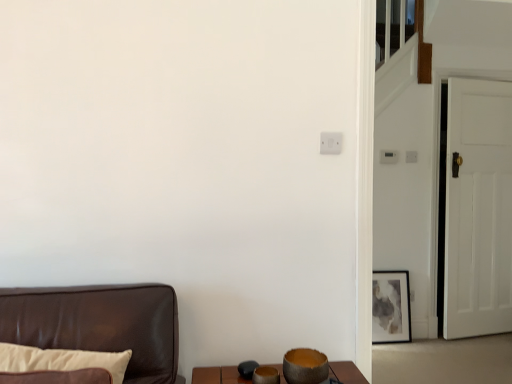
Question: Does matte gray painting at right have a greater height compared to white plastic light switch at upper right?

Choices:
 (A) no
 (B) yes

Answer: (B)

Question: From a real-world perspective, is matte gray painting at right over white plastic light switch at upper right?

Choices:
 (A) no
 (B) yes

Answer: (A)

Question: Is matte gray painting at right at the left side of white plastic light switch at upper right?

Choices:
 (A) no
 (B) yes

Answer: (A)

Question: Is matte gray painting at right smaller than white plastic light switch at upper right?

Choices:
 (A) yes
 (B) no

Answer: (B)

Question: From the image's perspective, does matte gray painting at right appear lower than white plastic light switch at upper right?

Choices:
 (A) no
 (B) yes

Answer: (B)

Question: From a real-world perspective, is matte gray painting at right located beneath white plastic light switch at upper right?

Choices:
 (A) no
 (B) yes

Answer: (B)

Question: From the image's perspective, is white wooden door at right on top of white plastic light switch at upper right?

Choices:
 (A) yes
 (B) no

Answer: (B)

Question: Does white wooden door at right have a larger size compared to white plastic light switch at upper right?

Choices:
 (A) no
 (B) yes

Answer: (B)

Question: Is white wooden door at right at the left side of white plastic light switch at upper right?

Choices:
 (A) no
 (B) yes

Answer: (A)

Question: Considering the relative sizes of white wooden door at right and white plastic light switch at upper right in the image provided, is white wooden door at right smaller than white plastic light switch at upper right?

Choices:
 (A) no
 (B) yes

Answer: (A)

Question: Can you confirm if white wooden door at right is positioned to the right of white plastic light switch at upper right?

Choices:
 (A) no
 (B) yes

Answer: (B)

Question: From the image's perspective, is white wooden door at right located beneath white plastic light switch at upper right?

Choices:
 (A) yes
 (B) no

Answer: (A)

Question: Does white wooden door at right turn towards matte gray painting at right?

Choices:
 (A) yes
 (B) no

Answer: (B)